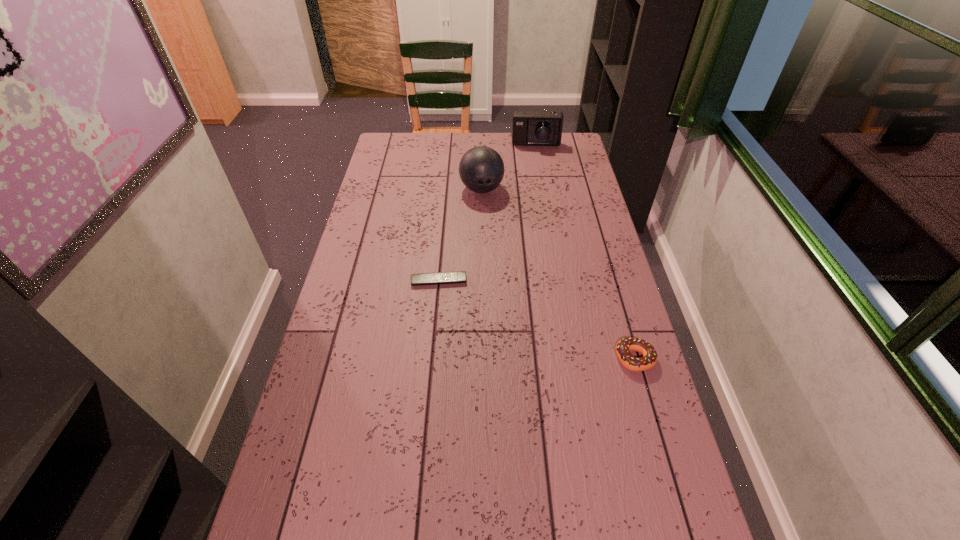
Locate an element on the screen. Image resolution: width=960 pixels, height=540 pixels. blank space at the far edge of the desktop is located at coordinates (x=471, y=139).

Where is `blank space at the near edge of the desktop`? Image resolution: width=960 pixels, height=540 pixels. blank space at the near edge of the desktop is located at coordinates (573, 505).

Where is `free space at the left edge`? free space at the left edge is located at coordinates (295, 451).

Find the location of a particular element. The width and height of the screenshot is (960, 540). free space at the right edge of the desktop is located at coordinates (583, 161).

What are the coordinates of `free space at the far left corner of the desktop` in the screenshot? It's located at (403, 148).

Locate an element on the screen. free region at the far right corner of the desktop is located at coordinates (551, 148).

Locate an element on the screen. This screenshot has width=960, height=540. vacant area that lies between the farthest object and the tallest object is located at coordinates (509, 167).

At what (x,y) coordinates should I click in order to perform the action: click on free area in between the rightmost object and the bowling ball. Please return your answer as a coordinate pair (x, y). Looking at the image, I should click on (558, 273).

Find the location of a particular element. The image size is (960, 540). free spot between the doughnut and the second object from right to left is located at coordinates (586, 252).

Find the location of `vacant point located between the shortest object and the farthest object`. vacant point located between the shortest object and the farthest object is located at coordinates (488, 213).